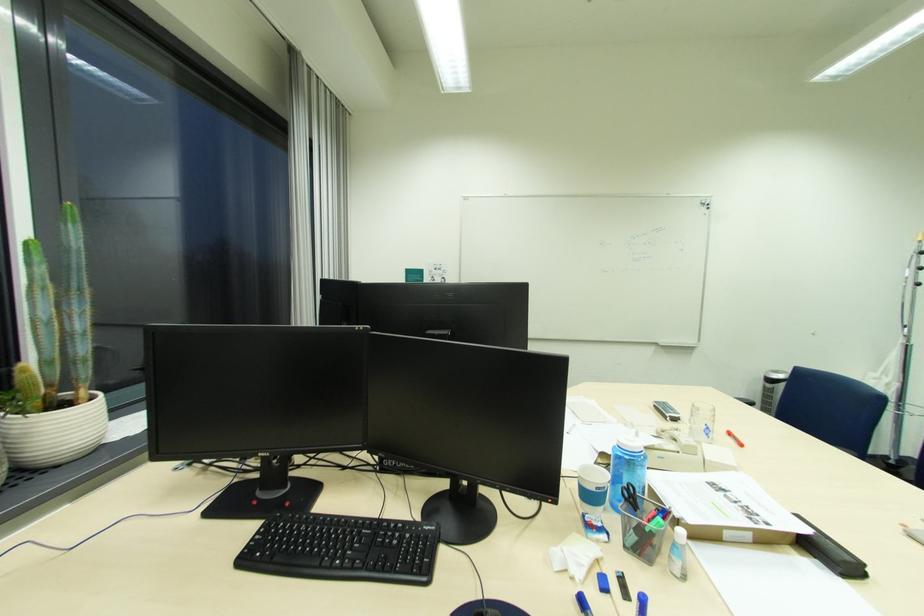
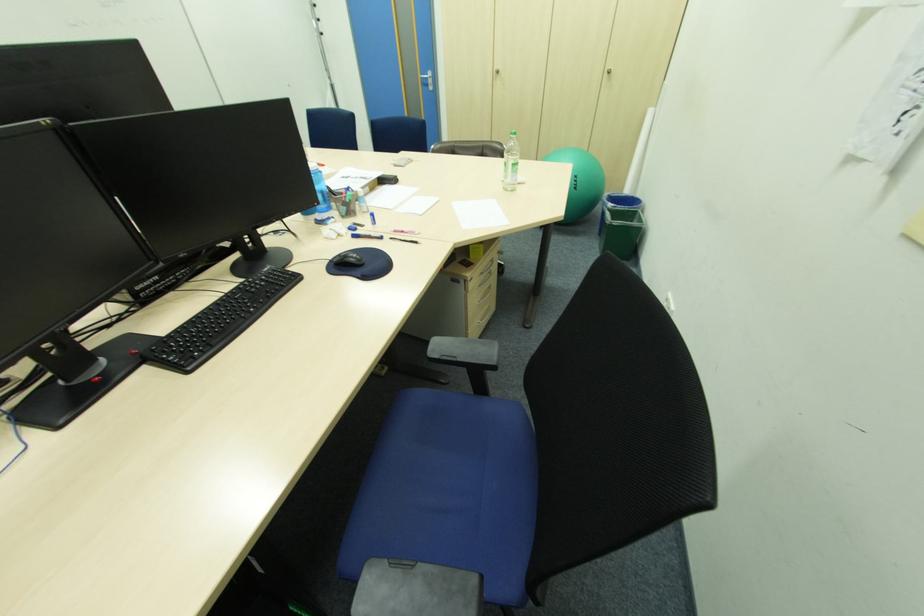
Based on the continuous images, in which direction is the camera rotating?

The rotation direction of the camera is right-down.